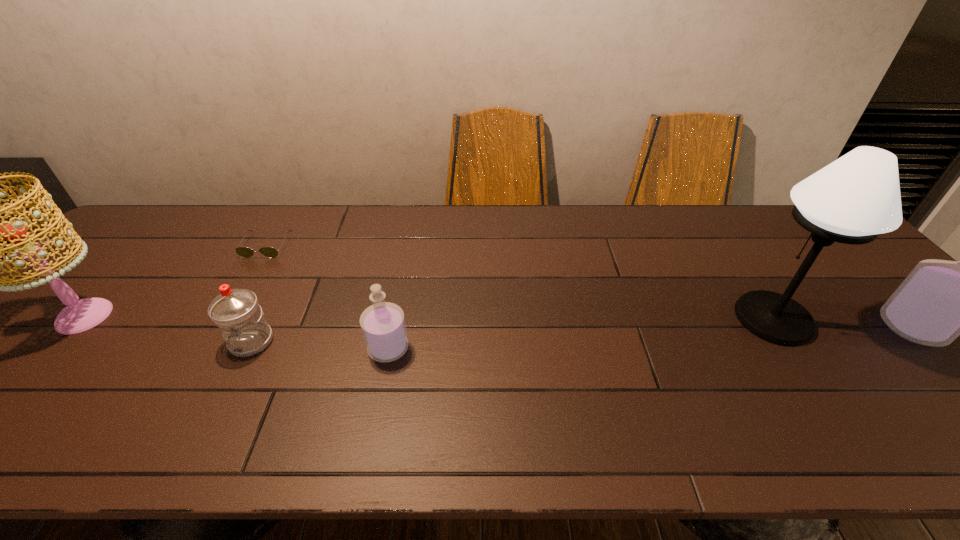
At what (x,y) coordinates should I click in order to perform the action: click on blank area located on the front-facing side of the farthest object. Please return your answer as a coordinate pair (x, y). Looking at the image, I should click on (223, 322).

What are the coordinates of `vacant region located on the right of the leftmost object` in the screenshot? It's located at (218, 316).

I want to click on vacant space situated 0.120m on the back of the table lamp, so click(x=736, y=264).

This screenshot has height=540, width=960. What are the coordinates of `vacant area situated 0.130m on the handle side of the water bottle` in the screenshot? It's located at (219, 408).

Find the location of `object that is at the far edge`. object that is at the far edge is located at coordinates (245, 252).

I want to click on object that is at the left edge, so click(81, 315).

Locate an element on the screen. vacant point at the far edge is located at coordinates (458, 233).

The width and height of the screenshot is (960, 540). Find the location of `vacant region at the near edge of the desktop`. vacant region at the near edge of the desktop is located at coordinates (644, 389).

This screenshot has height=540, width=960. In the image, there is a desktop. Find the location of `vacant space at the left edge`. vacant space at the left edge is located at coordinates (138, 267).

Where is `free region at the right edge of the desktop`? free region at the right edge of the desktop is located at coordinates (939, 355).